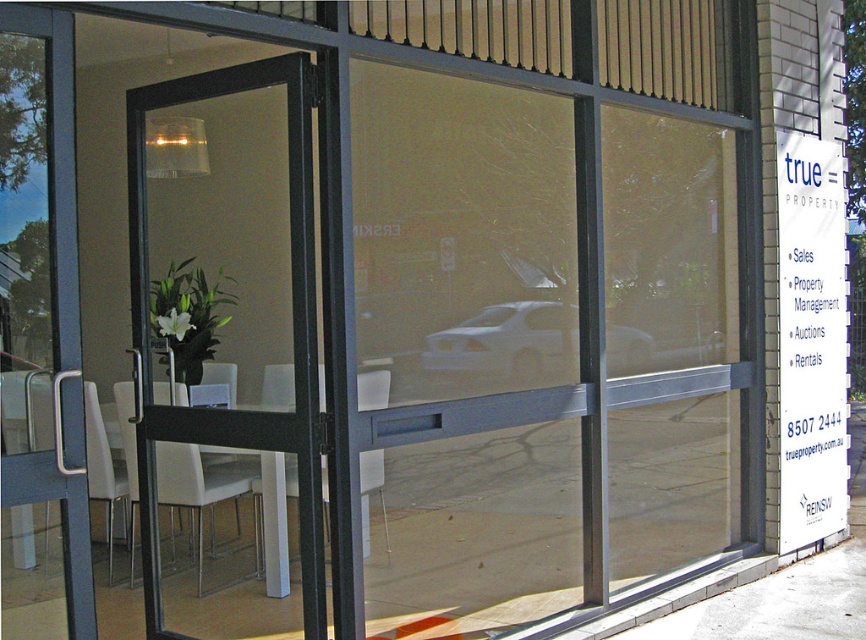
Does black glass screen door at center appear over white plastic chair at center?

Correct, black glass screen door at center is located above white plastic chair at center.

Does black glass screen door at center have a larger size compared to white plastic chair at center?

Incorrect, black glass screen door at center is not larger than white plastic chair at center.

Measure the distance between black glass screen door at center and camera.

The distance of black glass screen door at center from camera is 7.68 meters.

Identify the location of black glass screen door at center. The width and height of the screenshot is (866, 640). coord(225,346).